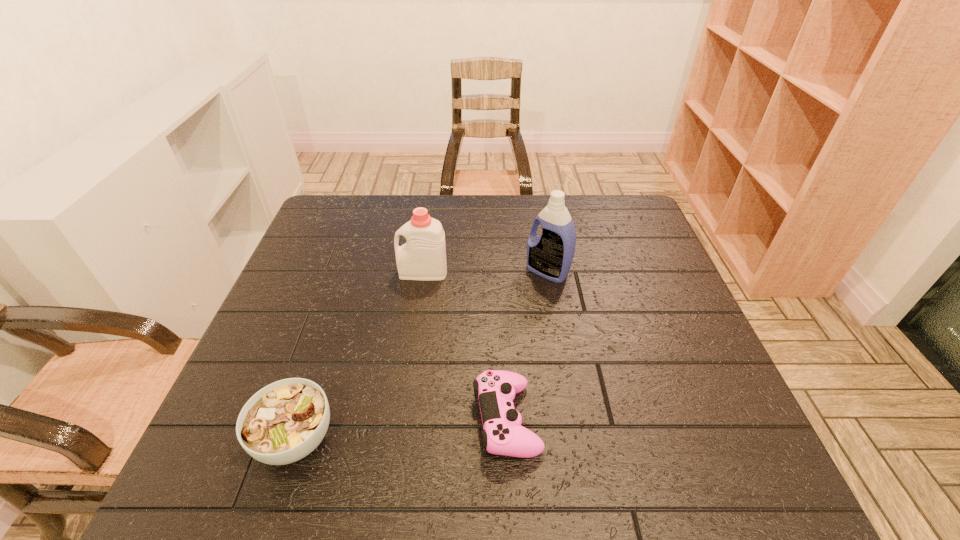
The width and height of the screenshot is (960, 540). Identify the location of free space located on the handle side of the shorter detergent. (311, 273).

Find the location of `free space located 0.240m on the handle side of the shorter detergent`. free space located 0.240m on the handle side of the shorter detergent is located at coordinates (311, 273).

The width and height of the screenshot is (960, 540). Find the location of `blank space located 0.160m on the back of the soup bowl`. blank space located 0.160m on the back of the soup bowl is located at coordinates (327, 342).

At what (x,y) coordinates should I click in order to perform the action: click on vacant area situated 0.170m on the back of the control. Please return your answer as a coordinate pair (x, y). Image resolution: width=960 pixels, height=540 pixels. Looking at the image, I should click on (502, 322).

Find the location of a particular element. The width and height of the screenshot is (960, 540). soup bowl situated at the near edge is located at coordinates (285, 421).

I want to click on control present at the near edge, so click(503, 434).

Locate an element on the screen. This screenshot has width=960, height=540. object that is positioned at the left edge is located at coordinates (285, 421).

Find the location of `object that is at the near left corner`. object that is at the near left corner is located at coordinates (285, 421).

You are a GUI agent. You are given a task and a screenshot of the screen. Output one action in this format:
    pyautogui.click(x=<x>, y=<y>)
    Task: Click on the free region at the far edge of the desktop
    
    Given the screenshot: What is the action you would take?
    [380, 203]

Identify the location of free location at the near edge of the desktop. (527, 476).